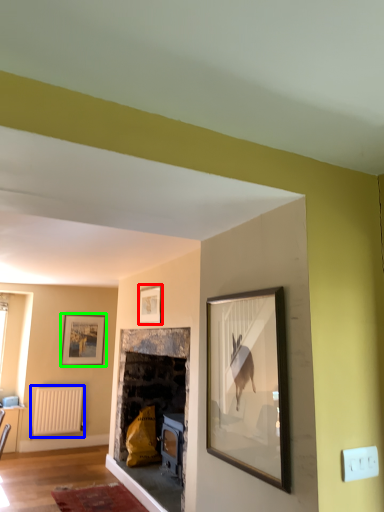
Question: Based on their relative distances, which object is farther from picture frame (highlighted by a red box)? Choose from radiator (highlighted by a blue box) and picture frame (highlighted by a green box).

Choices:
 (A) radiator
 (B) picture frame

Answer: (A)